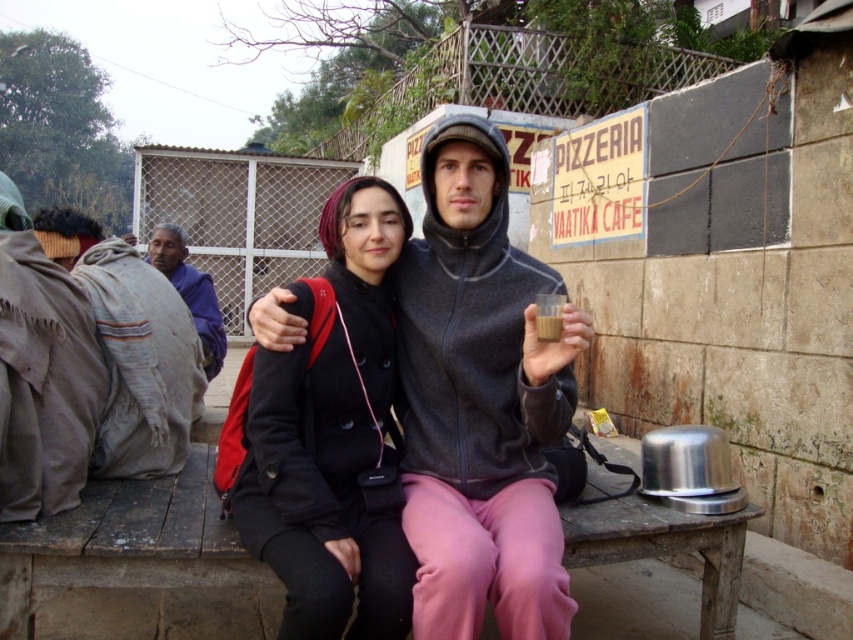
Who is more forward, (177, 378) or (206, 320)?

Positioned in front is point (177, 378).

The width and height of the screenshot is (853, 640). In order to click on brown woolen blanket at left in this screenshot , I will do `click(137, 346)`.

Is point (173, 384) more distant than point (180, 292)?

No, it is in front of (180, 292).

I want to click on brown woolen blanket at left, so click(137, 346).

Can you confirm if matte black coat at center is positioned to the right of black matte coat at center?

Correct, you'll find matte black coat at center to the right of black matte coat at center.

Find the location of `matte black coat at center`. matte black coat at center is located at coordinates (480, 401).

Image resolution: width=853 pixels, height=640 pixels. Find the location of `matte black coat at center`. matte black coat at center is located at coordinates (480, 401).

Is point (462, 358) behind point (209, 275)?

No, (462, 358) is closer to viewer.

Is matte black coat at center thinner than purple fabric at left?

Yes.

Between point (485, 355) and point (187, 282), which one is positioned in front?

Point (485, 355) is more forward.

This screenshot has height=640, width=853. Find the location of `matte black coat at center`. matte black coat at center is located at coordinates (480, 401).